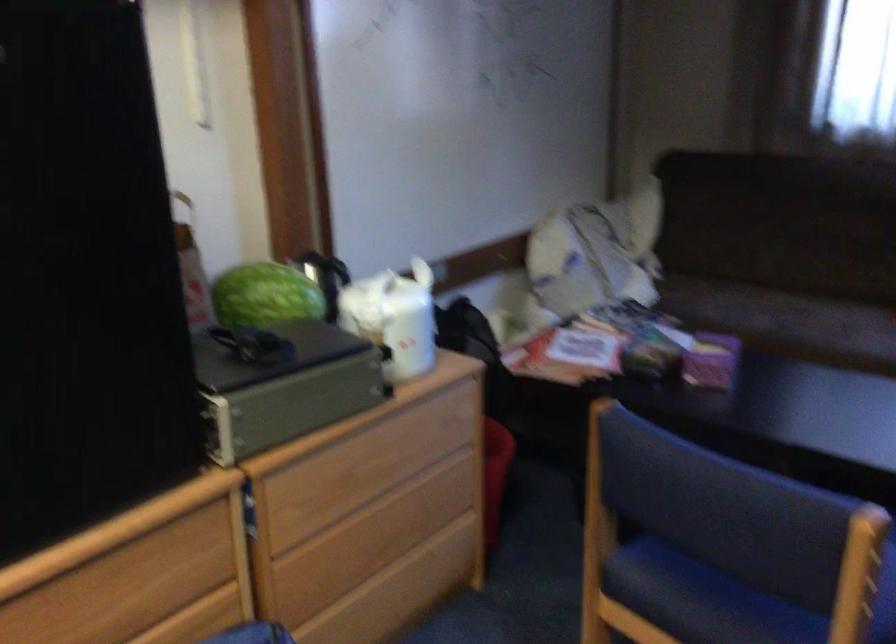
At what (x,y) coordinates should I click in order to perform the action: click on purple box. Please return your answer as a coordinate pair (x, y). This screenshot has height=644, width=896. Looking at the image, I should click on (711, 361).